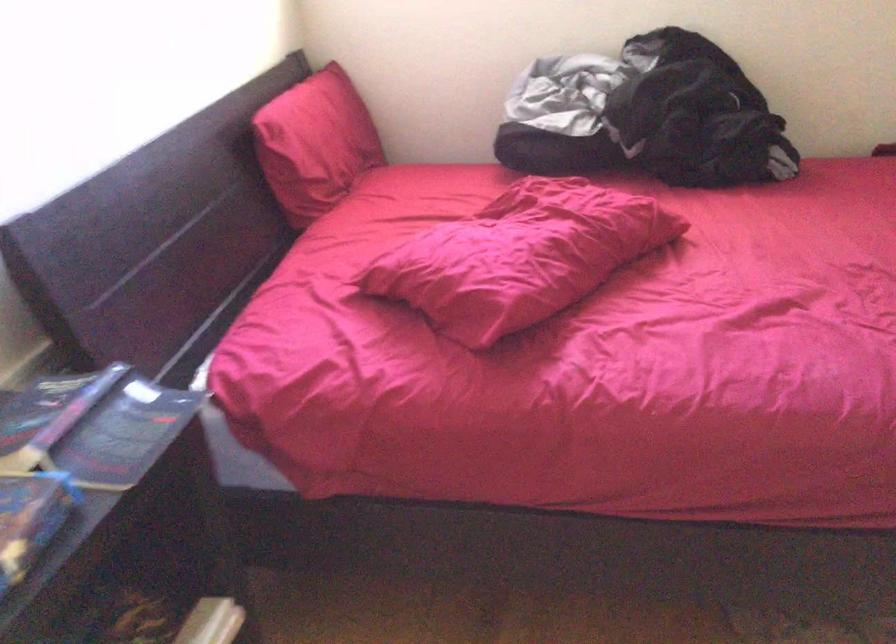
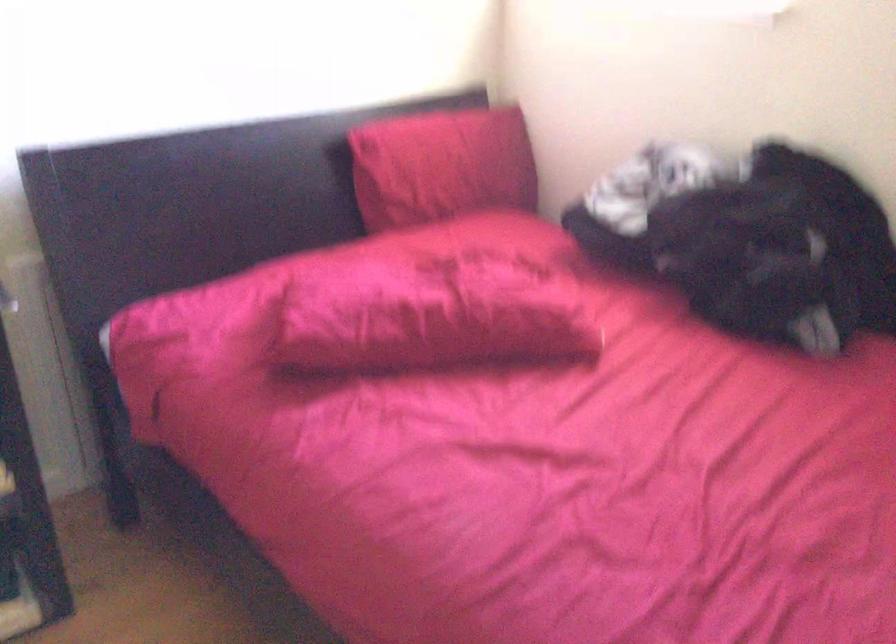
In the second image, find the point that corresponds to [573,243] in the first image.

(431, 316)